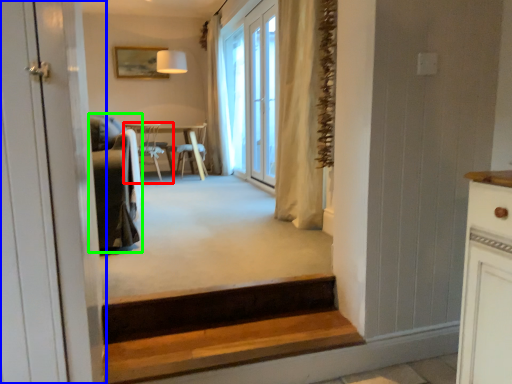
Question: Estimate the real-world distances between objects in this image. Which object is closer to chair (highlighted by a red box), door (highlighted by a blue box) or armchair (highlighted by a green box)?

Choices:
 (A) door
 (B) armchair

Answer: (B)